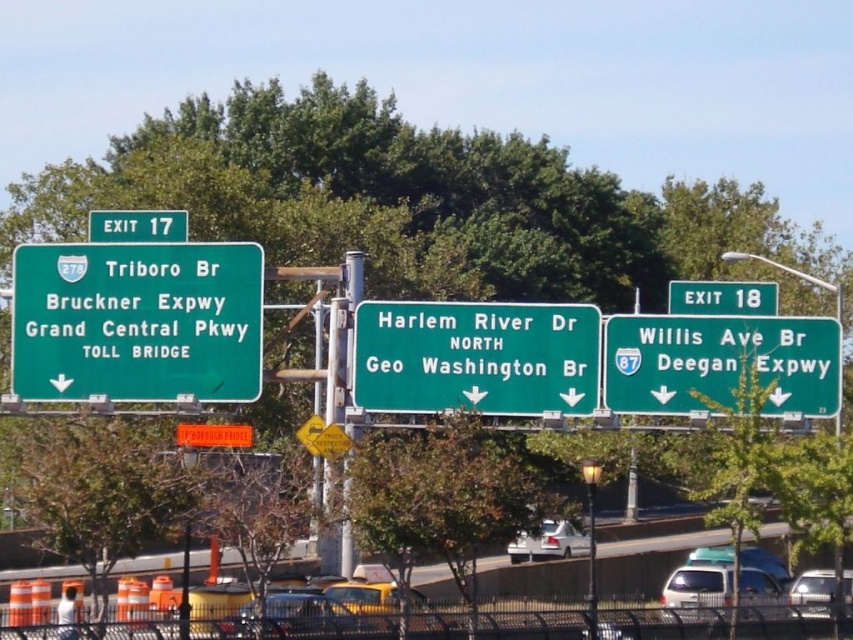
Question: Is green metallic sign at right above green matte sign at upper left?

Choices:
 (A) no
 (B) yes

Answer: (A)

Question: From the image, what is the correct spatial relationship of green matte highway sign at center in relation to green metallic sign at right?

Choices:
 (A) above
 (B) below

Answer: (B)

Question: Which point is closer to the camera?

Choices:
 (A) green matte sign at right
 (B) green metallic sign at right
 (C) green metallic sign at left

Answer: (A)

Question: Among these objects, which one is farthest from the camera?

Choices:
 (A) green matte sign at upper left
 (B) metallic pole at center

Answer: (A)

Question: Considering the relative positions of green metallic sign at left and green matte sign at upper left in the image provided, where is green metallic sign at left located with respect to green matte sign at upper left?

Choices:
 (A) right
 (B) left

Answer: (A)

Question: Among these objects, which one is farthest from the camera?

Choices:
 (A) metallic pole at center
 (B) green metallic sign at left
 (C) green matte sign at right
 (D) green matte sign at upper left

Answer: (D)